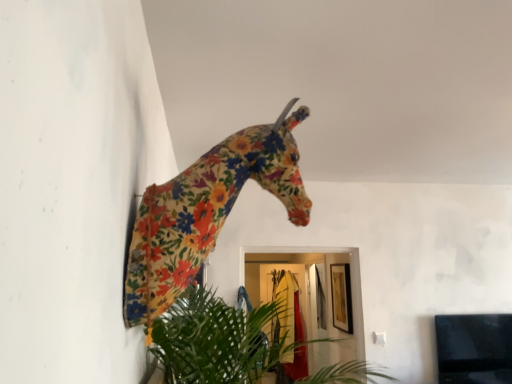
Question: Is green leafy plant at lower center completely or partially inside floral fabric giraffe at upper center?

Choices:
 (A) yes
 (B) no

Answer: (B)

Question: Is floral fabric giraffe at upper center behind green leafy plant at lower center?

Choices:
 (A) yes
 (B) no

Answer: (B)

Question: From the image's perspective, does floral fabric giraffe at upper center appear higher than green leafy plant at lower center?

Choices:
 (A) yes
 (B) no

Answer: (A)

Question: Considering the relative sizes of floral fabric giraffe at upper center and green leafy plant at lower center in the image provided, is floral fabric giraffe at upper center thinner than green leafy plant at lower center?

Choices:
 (A) yes
 (B) no

Answer: (A)

Question: Does floral fabric giraffe at upper center have a larger size compared to green leafy plant at lower center?

Choices:
 (A) yes
 (B) no

Answer: (B)

Question: Is green leafy plant at lower center at the back of floral fabric giraffe at upper center?

Choices:
 (A) no
 (B) yes

Answer: (A)

Question: From the image's perspective, would you say green leafy plant at lower center is positioned over floral fabric giraffe at upper center?

Choices:
 (A) no
 (B) yes

Answer: (A)

Question: From a real-world perspective, is green leafy plant at lower center over floral fabric giraffe at upper center?

Choices:
 (A) yes
 (B) no

Answer: (B)

Question: From a real-world perspective, is green leafy plant at lower center below floral fabric giraffe at upper center?

Choices:
 (A) yes
 (B) no

Answer: (A)

Question: Does green leafy plant at lower center have a greater width compared to floral fabric giraffe at upper center?

Choices:
 (A) yes
 (B) no

Answer: (A)

Question: Could you tell me if green leafy plant at lower center is turned towards floral fabric giraffe at upper center?

Choices:
 (A) no
 (B) yes

Answer: (A)

Question: Is green leafy plant at lower center taller than floral fabric giraffe at upper center?

Choices:
 (A) no
 (B) yes

Answer: (A)

Question: Is point (155, 332) closer or farther from the camera than point (162, 203)?

Choices:
 (A) farther
 (B) closer

Answer: (A)